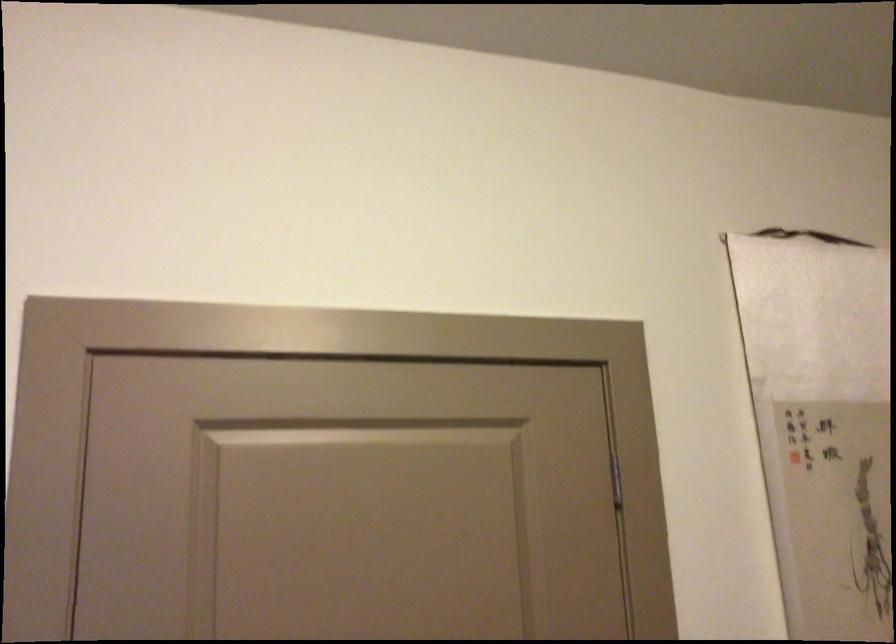
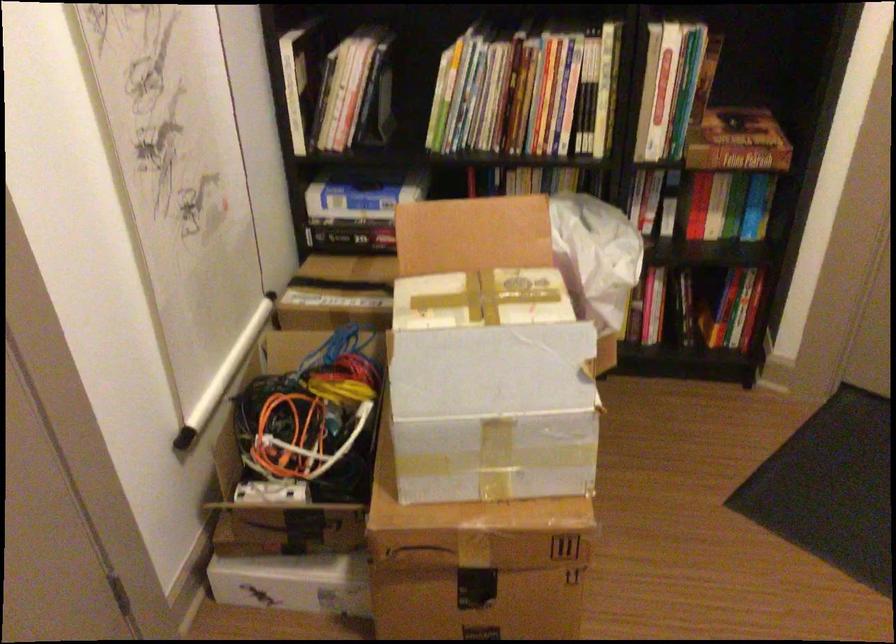
First-person continuous shooting, in which direction is the camera rotating?

The rotation direction of the camera is right-down.